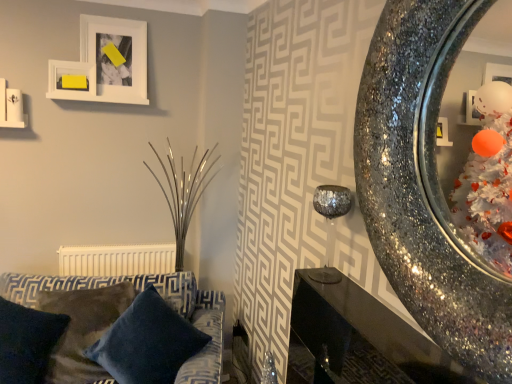
Question: Considering the relative sizes of white matte picture frame at upper left, the first picture frame in the right-to-left sequence, and sparkly metallic candle holder at upper right in the image provided, is white matte picture frame at upper left, the first picture frame in the right-to-left sequence, smaller than sparkly metallic candle holder at upper right?

Choices:
 (A) no
 (B) yes

Answer: (A)

Question: Is white matte picture frame at upper left, arranged as the 2th picture frame when viewed from the left, far from sparkly metallic candle holder at upper right?

Choices:
 (A) no
 (B) yes

Answer: (B)

Question: From the image's perspective, would you say white matte picture frame at upper left, the first picture frame in the right-to-left sequence, is positioned over sparkly metallic candle holder at upper right?

Choices:
 (A) yes
 (B) no

Answer: (A)

Question: Is white matte picture frame at upper left, arranged as the 2th picture frame when viewed from the left, in front of sparkly metallic candle holder at upper right?

Choices:
 (A) yes
 (B) no

Answer: (B)

Question: Is white matte picture frame at upper left, arranged as the 2th picture frame when viewed from the left, shorter than sparkly metallic candle holder at upper right?

Choices:
 (A) no
 (B) yes

Answer: (A)

Question: Is sparkly metallic candle holder at upper right surrounded by white matte picture frame at upper left, arranged as the 2th picture frame when viewed from the left?

Choices:
 (A) no
 (B) yes

Answer: (A)

Question: Does sparkly metallic mirror at right have a lesser height compared to shiny metallic table at lower right?

Choices:
 (A) yes
 (B) no

Answer: (B)

Question: Considering the relative sizes of sparkly metallic mirror at right and shiny metallic table at lower right in the image provided, is sparkly metallic mirror at right smaller than shiny metallic table at lower right?

Choices:
 (A) no
 (B) yes

Answer: (A)

Question: Considering the relative positions of sparkly metallic mirror at right and shiny metallic table at lower right in the image provided, is sparkly metallic mirror at right in front of shiny metallic table at lower right?

Choices:
 (A) no
 (B) yes

Answer: (B)

Question: Is sparkly metallic mirror at right bigger than shiny metallic table at lower right?

Choices:
 (A) no
 (B) yes

Answer: (B)

Question: Is sparkly metallic mirror at right outside of shiny metallic table at lower right?

Choices:
 (A) no
 (B) yes

Answer: (B)

Question: From the image's perspective, is sparkly metallic mirror at right located above shiny metallic table at lower right?

Choices:
 (A) yes
 (B) no

Answer: (A)

Question: Is yellow paper at upper left, acting as the 1th picture frame starting from the left, further to camera compared to sparkly metallic mirror at right?

Choices:
 (A) no
 (B) yes

Answer: (B)